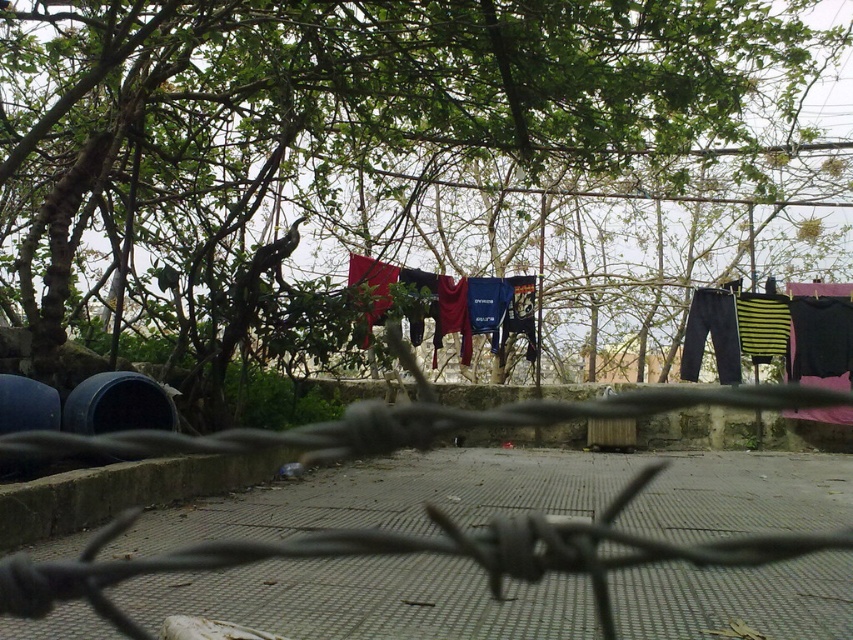
Is barbed wire at center taller than red fabric clothes at center?

No.

Which is above, barbed wire at center or red fabric clothes at center?

red fabric clothes at center

Describe the element at coordinates (399, 554) in the screenshot. The height and width of the screenshot is (640, 853). I see `barbed wire at center` at that location.

The width and height of the screenshot is (853, 640). In order to click on barbed wire at center in this screenshot , I will do `click(399, 554)`.

The height and width of the screenshot is (640, 853). Describe the element at coordinates (383, 163) in the screenshot. I see `green leafy tree at upper center` at that location.

Is green leafy tree at upper center taller than red fabric clothes at center?

Yes, green leafy tree at upper center is taller than red fabric clothes at center.

Does point (779, 81) come farther from viewer compared to point (367, 269)?

Yes, it is behind point (367, 269).

You are a GUI agent. You are given a task and a screenshot of the screen. Output one action in this format:
    pyautogui.click(x=<x>, y=<y>)
    Task: Click on the green leafy tree at upper center
    The image size is (853, 640).
    Given the screenshot: What is the action you would take?
    pyautogui.click(x=383, y=163)

Describe the element at coordinates (383, 163) in the screenshot. Image resolution: width=853 pixels, height=640 pixels. I see `green leafy tree at upper center` at that location.

Can you confirm if green leafy tree at upper center is thinner than barbed wire at center?

No.

What do you see at coordinates (383, 163) in the screenshot?
I see `green leafy tree at upper center` at bounding box center [383, 163].

What are the coordinates of `green leafy tree at upper center` in the screenshot? It's located at (383, 163).